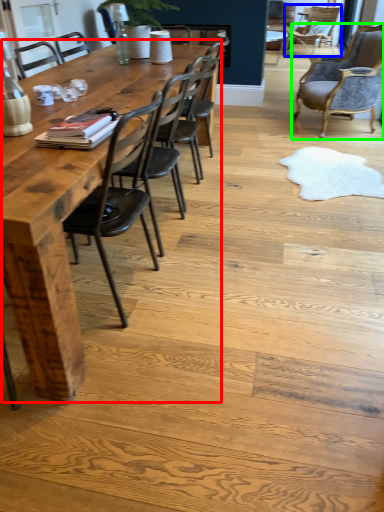
Question: Which object is the closest to the kitchen & dining room table (highlighted by a red box)? Choose among these: chair (highlighted by a blue box) or chair (highlighted by a green box).

Choices:
 (A) chair
 (B) chair

Answer: (B)